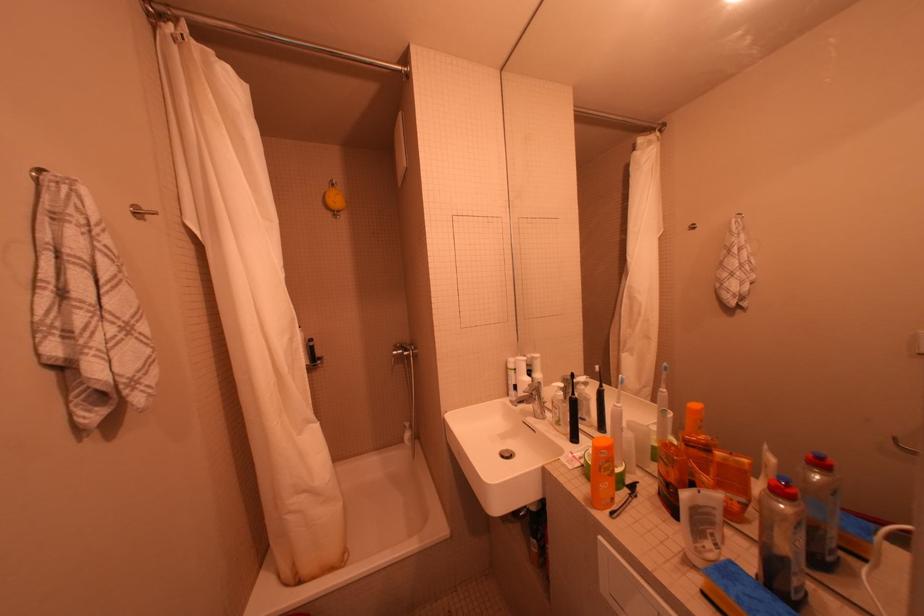
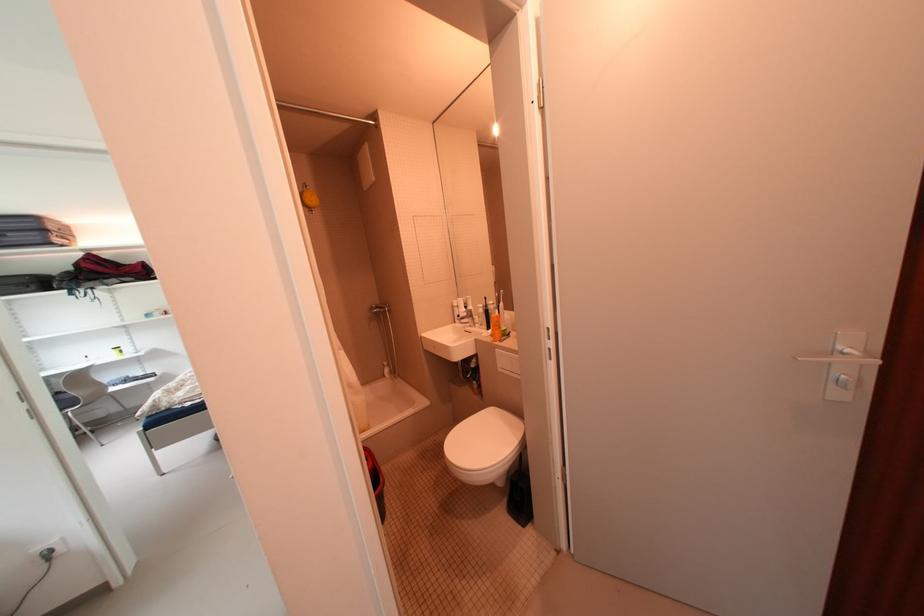
Locate, in the second image, the point that corresponds to the point at 415,351 in the first image.

(390, 309)